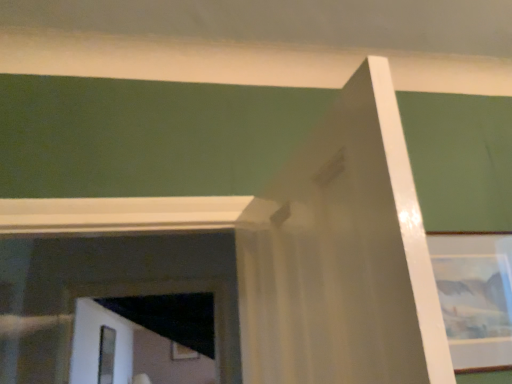
How much space does matte glass picture frame at upper right, which is counted as the second picture frame, starting from the bottom, occupy horizontally?

1.63 inches.

What do you see at coordinates (182, 352) in the screenshot? The height and width of the screenshot is (384, 512). I see `wooden picture frame at lower center, the first picture frame positioned from the left` at bounding box center [182, 352].

This screenshot has width=512, height=384. I want to click on clear glass screen door at lower left, so click(106, 355).

The height and width of the screenshot is (384, 512). Find the location of `matte glass picture frame at upper right, which ranks as the first picture frame in top-to-bottom order`. matte glass picture frame at upper right, which ranks as the first picture frame in top-to-bottom order is located at coordinates (475, 296).

From the image's perspective, is matte glass picture frame at upper right, which appears as the 1th picture frame when viewed from the right, located above or below wooden picture frame at lower center, which is the 2th picture frame in top-to-bottom order?

matte glass picture frame at upper right, which appears as the 1th picture frame when viewed from the right, is situated higher than wooden picture frame at lower center, which is the 2th picture frame in top-to-bottom order, in the image.

Between point (506, 276) and point (174, 358), which one is positioned in front?

The point (506, 276) is in front.

Is wooden picture frame at lower center, which is the 2th picture frame in top-to-bottom order, surrounded by matte glass picture frame at upper right, which ranks as the first picture frame in top-to-bottom order?

No, wooden picture frame at lower center, which is the 2th picture frame in top-to-bottom order, is not inside matte glass picture frame at upper right, which ranks as the first picture frame in top-to-bottom order.

Can you confirm if matte glass picture frame at upper right, which ranks as the first picture frame in top-to-bottom order, is wider than wooden picture frame at lower center, the second picture frame from the front?

Incorrect, the width of matte glass picture frame at upper right, which ranks as the first picture frame in top-to-bottom order, does not surpass that of wooden picture frame at lower center, the second picture frame from the front.

Can you confirm if clear glass screen door at lower left is wider than matte glass picture frame at upper right, which appears as the 1th picture frame when viewed from the right?

Yes, clear glass screen door at lower left is wider than matte glass picture frame at upper right, which appears as the 1th picture frame when viewed from the right.

Does clear glass screen door at lower left have a smaller size compared to matte glass picture frame at upper right, which ranks as the 2th picture frame in back-to-front order?

Incorrect, clear glass screen door at lower left is not smaller in size than matte glass picture frame at upper right, which ranks as the 2th picture frame in back-to-front order.

Is there a large distance between clear glass screen door at lower left and matte glass picture frame at upper right, the 1th picture frame viewed from the front?

That's right, there is a large distance between clear glass screen door at lower left and matte glass picture frame at upper right, the 1th picture frame viewed from the front.

Is clear glass screen door at lower left spatially inside matte glass picture frame at upper right, which ranks as the 2th picture frame in back-to-front order, or outside of it?

clear glass screen door at lower left is located beyond the bounds of matte glass picture frame at upper right, which ranks as the 2th picture frame in back-to-front order.

Which is nearer, (172, 341) or (108, 349)?

Clearly, point (172, 341) is closer to the camera than point (108, 349).

Is wooden picture frame at lower center, the 1th picture frame in the back-to-front sequence, not within clear glass screen door at lower left?

Absolutely, wooden picture frame at lower center, the 1th picture frame in the back-to-front sequence, is external to clear glass screen door at lower left.

Which object is wider, wooden picture frame at lower center, the second picture frame from the front, or clear glass screen door at lower left?

clear glass screen door at lower left.

Is there a large distance between matte glass picture frame at upper right, the 1th picture frame viewed from the front, and clear glass screen door at lower left?

Yes.

Is matte glass picture frame at upper right, which ranks as the first picture frame in top-to-bottom order, situated inside clear glass screen door at lower left or outside?

matte glass picture frame at upper right, which ranks as the first picture frame in top-to-bottom order, is not enclosed by clear glass screen door at lower left.

Can you tell me how much matte glass picture frame at upper right, which appears as the 1th picture frame when viewed from the right, and clear glass screen door at lower left differ in facing direction?

The angular difference between matte glass picture frame at upper right, which appears as the 1th picture frame when viewed from the right, and clear glass screen door at lower left is 87.6 degrees.

From a real-world perspective, is matte glass picture frame at upper right, which is counted as the second picture frame, starting from the bottom, positioned under clear glass screen door at lower left based on gravity?

No, from a real-world perspective, matte glass picture frame at upper right, which is counted as the second picture frame, starting from the bottom, is not under clear glass screen door at lower left.

Is wooden picture frame at lower center, the 1th picture frame in the back-to-front sequence, aimed at matte glass picture frame at upper right, the 1th picture frame viewed from the front?

Yes.

Based on the photo, in terms of height, does wooden picture frame at lower center, which is the 2th picture frame in top-to-bottom order, look taller or shorter compared to matte glass picture frame at upper right, which ranks as the first picture frame in top-to-bottom order?

wooden picture frame at lower center, which is the 2th picture frame in top-to-bottom order, is shorter than matte glass picture frame at upper right, which ranks as the first picture frame in top-to-bottom order.

Is wooden picture frame at lower center, the first picture frame positioned from the left, completely or partially outside of matte glass picture frame at upper right, which appears as the 1th picture frame when viewed from the right?

Yes, wooden picture frame at lower center, the first picture frame positioned from the left, is located beyond the bounds of matte glass picture frame at upper right, which appears as the 1th picture frame when viewed from the right.

From the image's perspective, would you say wooden picture frame at lower center, the second picture frame from the front, is shown under matte glass picture frame at upper right, the 1th picture frame viewed from the front?

Yes, from the image's perspective, wooden picture frame at lower center, the second picture frame from the front, is beneath matte glass picture frame at upper right, the 1th picture frame viewed from the front.

Measure the distance from clear glass screen door at lower left to wooden picture frame at lower center, which is the first picture frame in bottom-to-top order.

They are 25.26 inches apart.

Considering the positions of objects clear glass screen door at lower left and wooden picture frame at lower center, the second picture frame from the front, in the image provided, who is more to the left, clear glass screen door at lower left or wooden picture frame at lower center, the second picture frame from the front,?

clear glass screen door at lower left is more to the left.

I want to click on picture frame behind the clear glass screen door at lower left, so click(x=182, y=352).

Is clear glass screen door at lower left thinner than wooden picture frame at lower center, which is the first picture frame in bottom-to-top order?

Incorrect, the width of clear glass screen door at lower left is not less than that of wooden picture frame at lower center, which is the first picture frame in bottom-to-top order.

This screenshot has height=384, width=512. In order to click on picture frame that is behind the matte glass picture frame at upper right, which ranks as the first picture frame in top-to-bottom order in this screenshot , I will do `click(182, 352)`.

There is a clear glass screen door at lower left. Identify the location of the 2nd picture frame above it (from a real-world perspective). click(x=475, y=296).

From the image, which object appears to be nearer to matte glass picture frame at upper right, the 2th picture frame viewed from the left, clear glass screen door at lower left or wooden picture frame at lower center, the first picture frame positioned from the left?

wooden picture frame at lower center, the first picture frame positioned from the left.

Which object lies further to the anchor point clear glass screen door at lower left, wooden picture frame at lower center, which is the 2th picture frame in top-to-bottom order, or matte glass picture frame at upper right, the 1th picture frame viewed from the front?

matte glass picture frame at upper right, the 1th picture frame viewed from the front, is positioned further to the anchor clear glass screen door at lower left.

Based on their spatial positions, is wooden picture frame at lower center, which is the first picture frame in bottom-to-top order, or clear glass screen door at lower left further from matte glass picture frame at upper right, which appears as the 1th picture frame when viewed from the right?

Among the two, clear glass screen door at lower left is located further to matte glass picture frame at upper right, which appears as the 1th picture frame when viewed from the right.

When comparing their distances from wooden picture frame at lower center, the 1th picture frame in the back-to-front sequence, does matte glass picture frame at upper right, the 2th picture frame viewed from the left, or clear glass screen door at lower left seem further?

matte glass picture frame at upper right, the 2th picture frame viewed from the left, is further to wooden picture frame at lower center, the 1th picture frame in the back-to-front sequence.

Considering their positions, is matte glass picture frame at upper right, which ranks as the 2th picture frame in back-to-front order, positioned closer to clear glass screen door at lower left than wooden picture frame at lower center, which is the first picture frame in bottom-to-top order?

wooden picture frame at lower center, which is the first picture frame in bottom-to-top order, is closer to clear glass screen door at lower left.

In the scene shown: Estimate the real-world distances between objects in this image. Which object is closer to wooden picture frame at lower center, which is the 2th picture frame in top-to-bottom order, clear glass screen door at lower left or matte glass picture frame at upper right, which ranks as the 2th picture frame in back-to-front order?

Among the two, clear glass screen door at lower left is located nearer to wooden picture frame at lower center, which is the 2th picture frame in top-to-bottom order.

Find the location of a particular element. screen door between matte glass picture frame at upper right, which is counted as the second picture frame, starting from the bottom, and wooden picture frame at lower center, arranged as the 2th picture frame when viewed from the right, in the front-back direction is located at coordinates (106, 355).